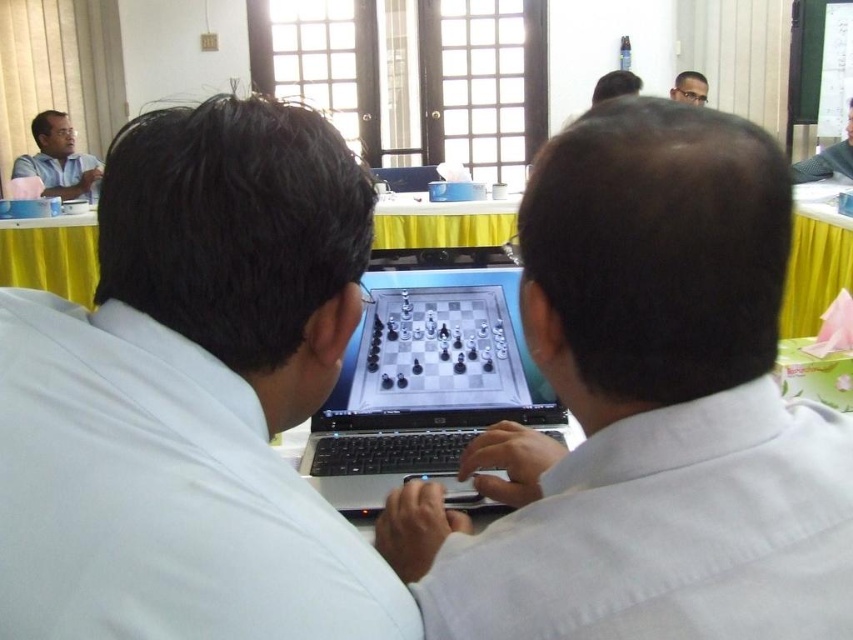
Can you confirm if white matte shirt at center is positioned below silver/black keyboard at center?

Incorrect, white matte shirt at center is not positioned below silver/black keyboard at center.

The height and width of the screenshot is (640, 853). Identify the location of white matte shirt at center. (647, 410).

Locate an element on the screen. The width and height of the screenshot is (853, 640). white matte shirt at center is located at coordinates (647, 410).

Image resolution: width=853 pixels, height=640 pixels. I want to click on white matte shirt at center, so [x=647, y=410].

Where is `silver/black keyboard at center`? The width and height of the screenshot is (853, 640). silver/black keyboard at center is located at coordinates (425, 387).

Describe the element at coordinates (425, 387) in the screenshot. I see `silver/black keyboard at center` at that location.

Identify the location of silver/black keyboard at center. The height and width of the screenshot is (640, 853). (425, 387).

Is point (440, 305) more distant than point (80, 260)?

That is False.

Does point (381, 392) come behind point (793, 253)?

No, it is not.

You are a GUI agent. You are given a task and a screenshot of the screen. Output one action in this format:
    pyautogui.click(x=<x>, y=<y>)
    Task: Click on the silver/black keyboard at center
    This screenshot has width=853, height=640.
    Given the screenshot: What is the action you would take?
    tap(425, 387)